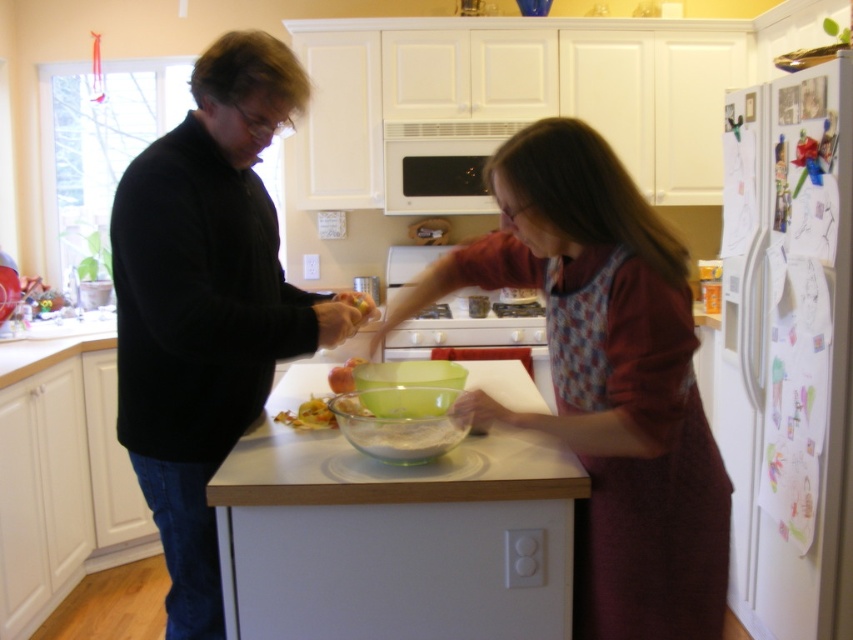
Question: Among these objects, which one is nearest to the camera?

Choices:
 (A) green plastic bowl at center
 (B) white matte microwave at center

Answer: (A)

Question: Which point is closer to the camera?

Choices:
 (A) (426, 195)
 (B) (624, 273)

Answer: (B)

Question: Does yellowish matte shredded food at center appear on the left side of translucent plastic bag at center?

Choices:
 (A) no
 (B) yes

Answer: (B)

Question: Does white matte microwave at center appear under translucent plastic bag at center?

Choices:
 (A) yes
 (B) no

Answer: (B)

Question: Can you confirm if clear glass bowl at center is positioned to the left of green plastic bowl at center?

Choices:
 (A) yes
 (B) no

Answer: (B)

Question: Which of the following is the farthest from the observer?

Choices:
 (A) yellowish matte shredded food at center
 (B) clear glass bowl at center
 (C) green glass bowl at center
 (D) translucent plastic bag at center

Answer: (D)